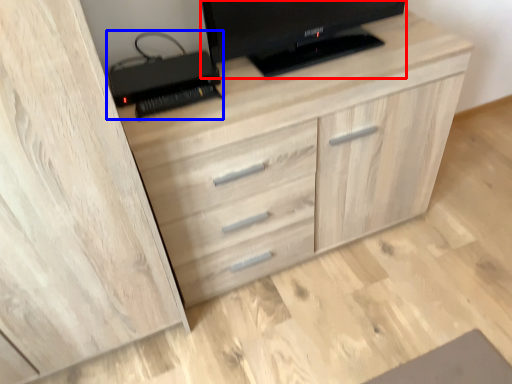
Question: Which object is further to the camera taking this photo, television (highlighted by a red box) or computer (highlighted by a blue box)?

Choices:
 (A) television
 (B) computer

Answer: (B)